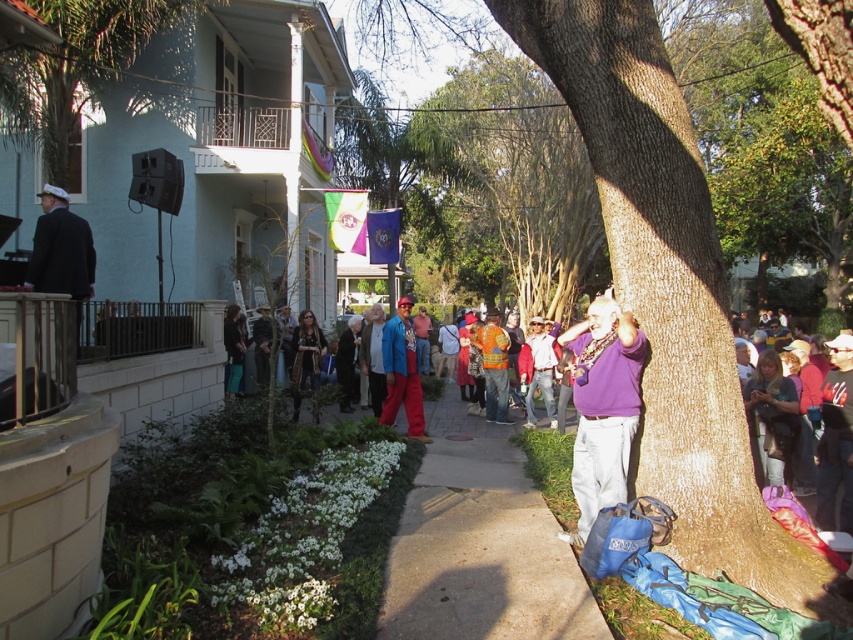
Which is behind, point (596, 504) or point (83, 248)?

Point (83, 248)

Is point (622, 317) less distant than point (83, 253)?

Yes, it is in front of point (83, 253).

Is point (601, 422) farther from camera compared to point (54, 252)?

No, (601, 422) is in front of (54, 252).

At what (x,y) coordinates should I click in order to perform the action: click on purple cotton shirt at center-right. Please return your answer as a coordinate pair (x, y). Looking at the image, I should click on (602, 406).

Is point (74, 216) more distant than point (402, 356)?

No, (74, 216) is closer to viewer.

Does matte black suit at left appear under shiny blue jacket at center?

No, matte black suit at left is not below shiny blue jacket at center.

Describe the element at coordinates (61, 252) in the screenshot. The height and width of the screenshot is (640, 853). I see `matte black suit at left` at that location.

Identify the location of matte black suit at left. This screenshot has height=640, width=853. (61, 252).

Is the position of green leafy tree at upper left less distant than that of purple cotton shirt at center-right?

No.

Image resolution: width=853 pixels, height=640 pixels. Describe the element at coordinates (93, 68) in the screenshot. I see `green leafy tree at upper left` at that location.

The height and width of the screenshot is (640, 853). I want to click on green leafy tree at upper left, so click(x=93, y=68).